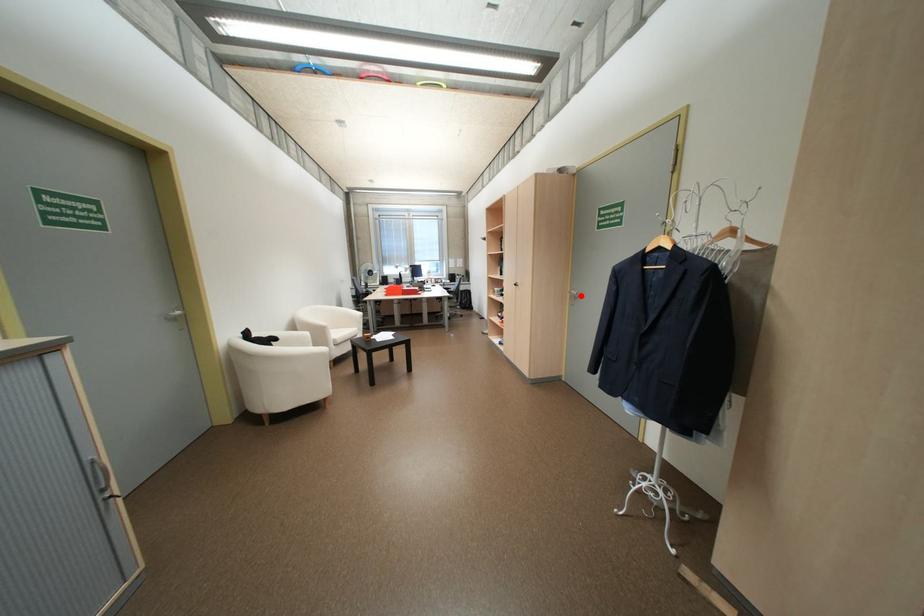
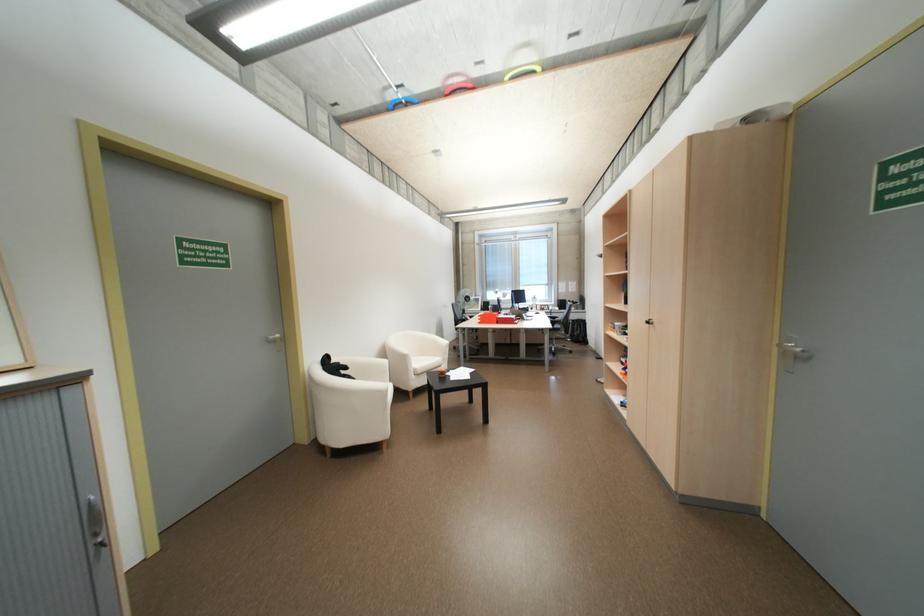
Question: I am providing you with two images of the same scene from different viewpoints. A red point is marked on the first image. Can you still see the location of the red point in image 2?

Choices:
 (A) Yes
 (B) No

Answer: (A)